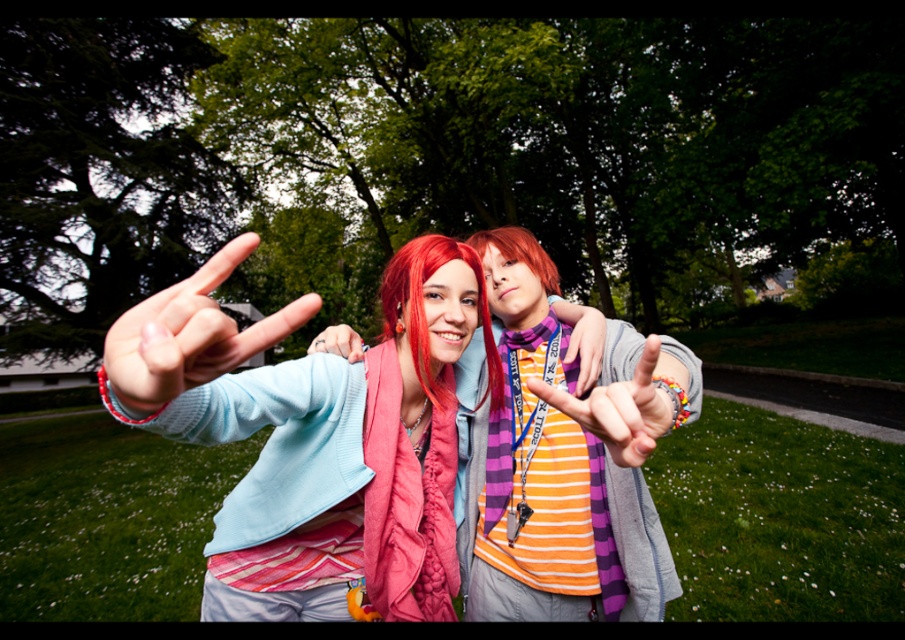
Between knitted pink scarf at center and matte orange shirt at center, which one has more height?

With more height is knitted pink scarf at center.

Can you confirm if knitted pink scarf at center is positioned below matte orange shirt at center?

Indeed, knitted pink scarf at center is positioned under matte orange shirt at center.

Between point (392, 499) and point (467, 256), which one is positioned in front?

Point (392, 499)

Locate an element on the screen. The width and height of the screenshot is (905, 640). knitted pink scarf at center is located at coordinates (408, 499).

Who is higher up, knitted pink scarf at center or vivid red hair at center?

Positioned higher is vivid red hair at center.

Find the location of a particular element. The height and width of the screenshot is (640, 905). knitted pink scarf at center is located at coordinates (408, 499).

Is matte blue hand at center further to the viewer compared to matte orange shirt at center?

No, it is in front of matte orange shirt at center.

Describe the element at coordinates (189, 333) in the screenshot. I see `matte blue hand at center` at that location.

The image size is (905, 640). I want to click on matte blue hand at center, so [189, 333].